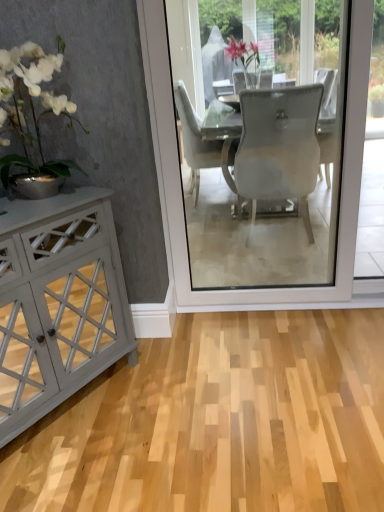
Identify the location of empty space that is to the right of matte gray cabinet at left. (171, 399).